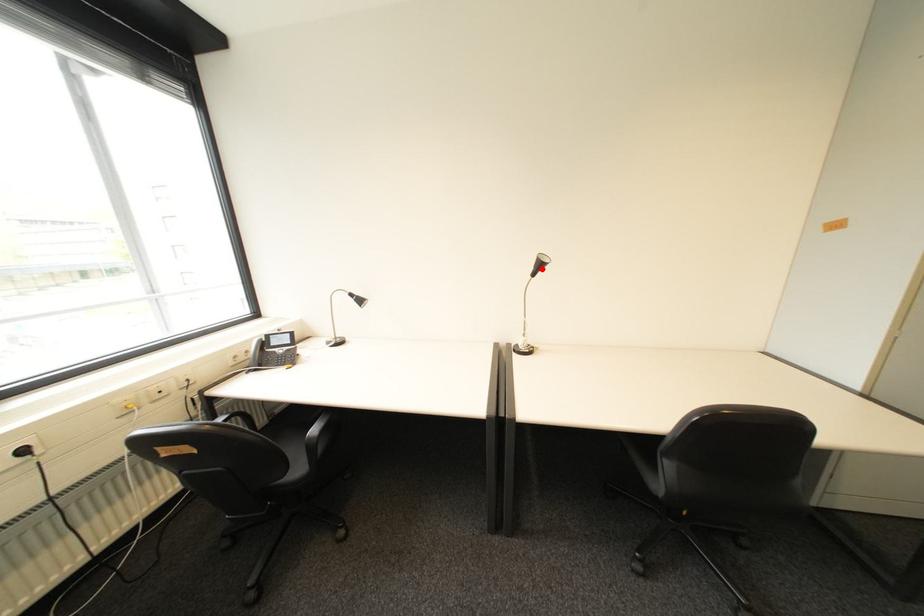
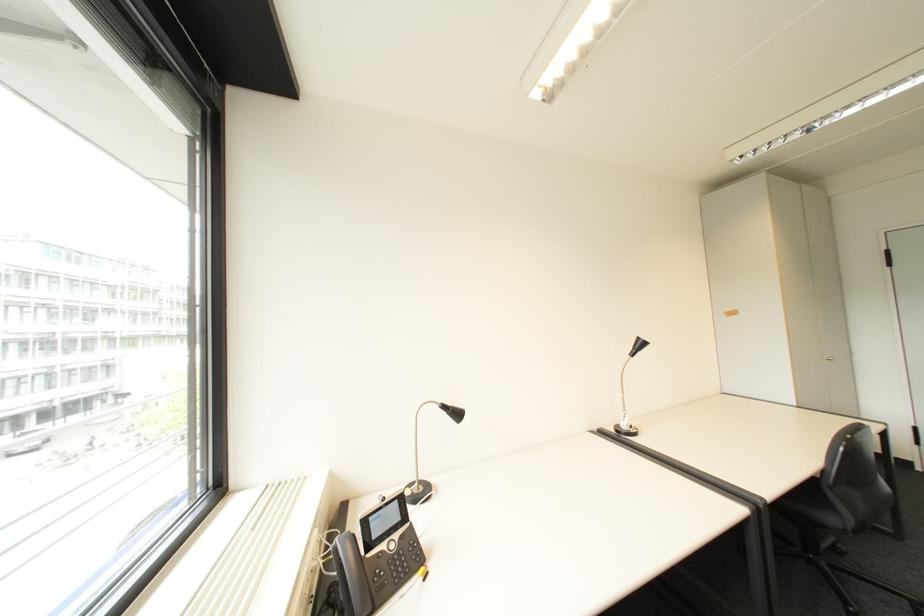
The point at the highlighted location is marked in the first image. Where is the corresponding point in the second image?

(640, 350)